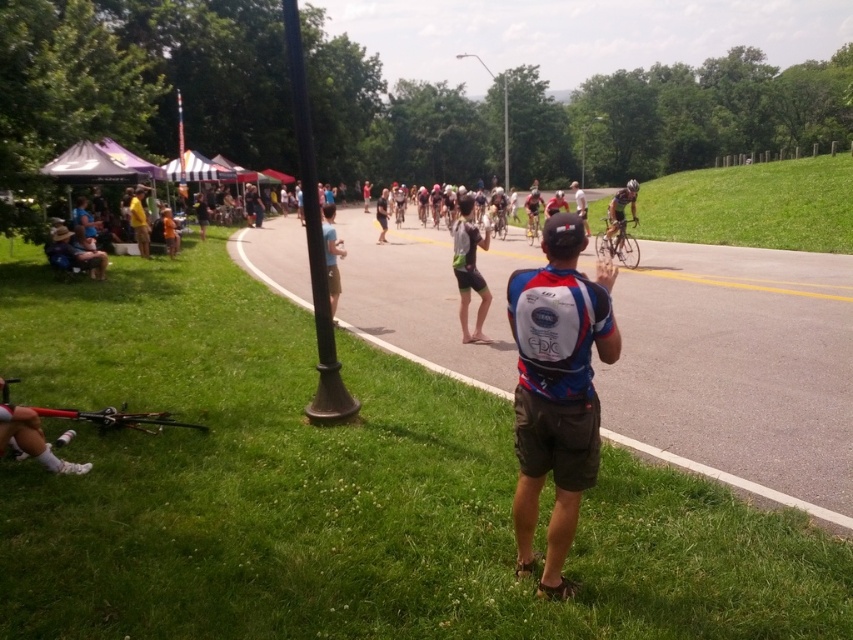
You are a photographer positioned at the center of the scene. You need to capture a photo where both the light blue fabric shirt at center and the yellow fabric tent at left are visible. Considering their heights, which object will appear larger in the photo?

The light blue fabric shirt at center will appear larger in the photo because it has a greater height compared to the yellow fabric tent at left.

You are a photographer positioned at the center of the scene. You need to capture a photo that includes both the light blue fabric shirt at center and the yellow fabric tent at left. Given their widths, which object should you frame first to ensure both fit in the shot?

The light blue fabric shirt at center is wider than the yellow fabric tent at left, so you should frame the light blue fabric shirt at center first to accommodate its larger width in the photo.

You are a participant in the cycling event and need to retrieve your white mesh backpack at center before proceeding. However, you are currently standing on the green grass at right. In which direction should you move to reach your backpack?

The white mesh backpack at center is to the left of green grass at right, so you should move to the left to reach your backpack.